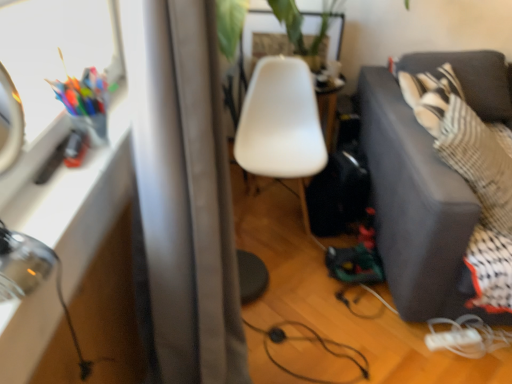
This screenshot has height=384, width=512. What are the coordinates of `vacant space situated on the left part of white matte extension cord at lower right` in the screenshot? It's located at click(408, 347).